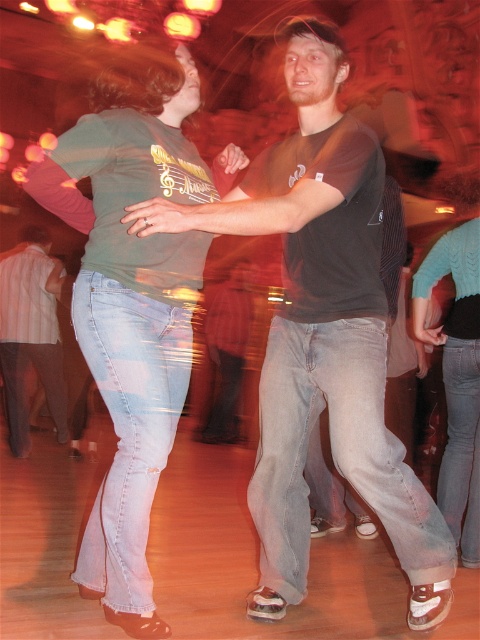
In the scene shown: You are at a party and want to find the point at coordinates (322, 333) in the image. According to the scene description, where is this point located?

The point at coordinates (322, 333) is located on the matte black t shirt at center.